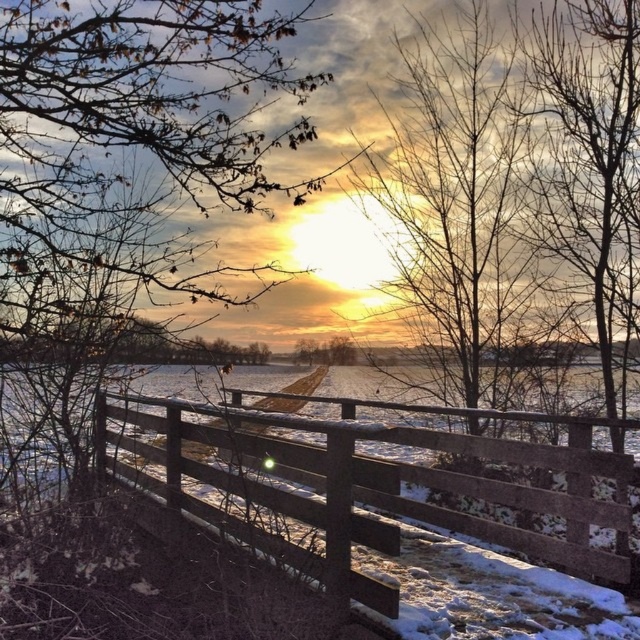
Question: Which point is closer to the camera?

Choices:
 (A) (342, 362)
 (B) (547, 104)
 (C) (396, 413)
 (D) (468, 157)

Answer: (B)

Question: Does wooden fence at center have a greater width compared to bare wood tree at upper right?

Choices:
 (A) no
 (B) yes

Answer: (B)

Question: Does brown leafy branches at upper left have a greater width compared to snow-covered bare tree at center?

Choices:
 (A) no
 (B) yes

Answer: (B)

Question: Is bare wood tree at upper right thinner than bare branches at center?

Choices:
 (A) yes
 (B) no

Answer: (B)

Question: Which point is closer to the camera?

Choices:
 (A) (298, 342)
 (B) (636, 442)

Answer: (A)

Question: Which object is farther from the camera taking this photo?

Choices:
 (A) snow-covered bare tree at center
 (B) bare branches at center
 (C) bare wood tree at upper right
 (D) wooden fence at center

Answer: (B)